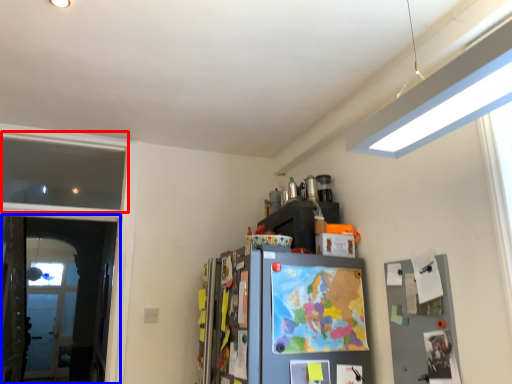
Question: Which object is further to the camera taking this photo, window (highlighted by a red box) or screen door (highlighted by a blue box)?

Choices:
 (A) window
 (B) screen door

Answer: (A)